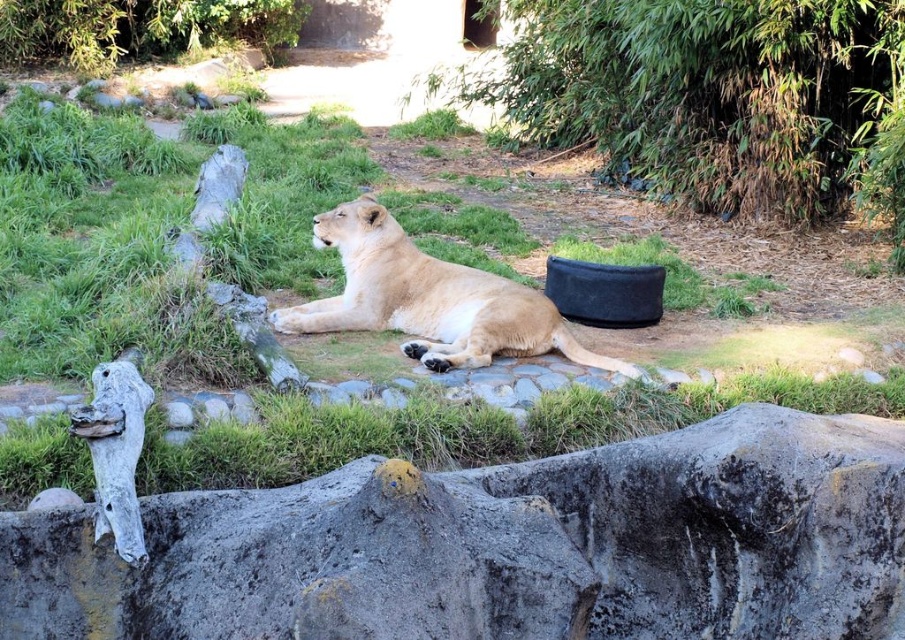
You are a zookeeper observing the lioness in her enclosure. You notice the rough gray rock at lower center and the light brown fur at center. Which object is located to the right of the other?

The rough gray rock at lower center is positioned on the right side of light brown fur at center, so the rough gray rock at lower center is to the right of the light brown fur at center.

You are a zookeeper observing the lioness in her enclosure. You notice the green grass at center and the light brown fur at center. Which object is closer to you as you stand at the entrance?

The green grass at center is closer to you because it is in front of the light brown fur at center, meaning the fur is further back in the enclosure.

You are a zookeeper preparing to place a new feeding bowl for the lioness. The bowl requires a stable surface wider than the lioness. Which object should you choose between the rough gray rock at lower center and the light brown fur at center?

The rough gray rock at lower center might be wider than the light brown fur at center, so the zookeeper should choose the rough gray rock at lower center as it has a wider surface to place the feeding bowl.